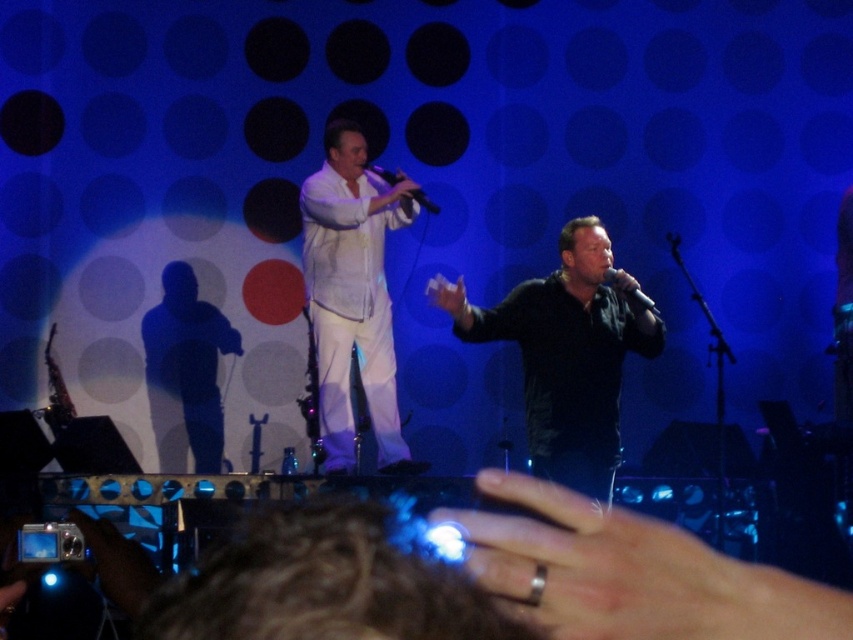
You are a stagehand adjusting the lighting for the performance. You notice two microphones on stage. Which one is closer to the audience between the matte black microphone at center and the black matte microphone at center?

The matte black microphone at center is closer to the audience because it is further to the viewer than the black matte microphone at center.

You are a stagehand adjusting the lighting for the performance. You need to ensure that the black matte shirt at center and the black matte microphone at center are both clearly visible. Since the microphone is smaller, which object might require a brighter light to stand out more?

The black matte microphone at center is smaller than the black matte shirt at center, so it might require a brighter light to ensure it stands out more.

You are standing at point point (155, 332) and want to take a photo of the stage. The camera you have can focus on objects up to 6 meters away. Will the camera be able to focus on the stage?

The distance between point (155, 332) and the camera is 6.28 meters, which exceeds the camera maximum focus range of 6 meters. Therefore, the camera will not be able to focus on the stage.